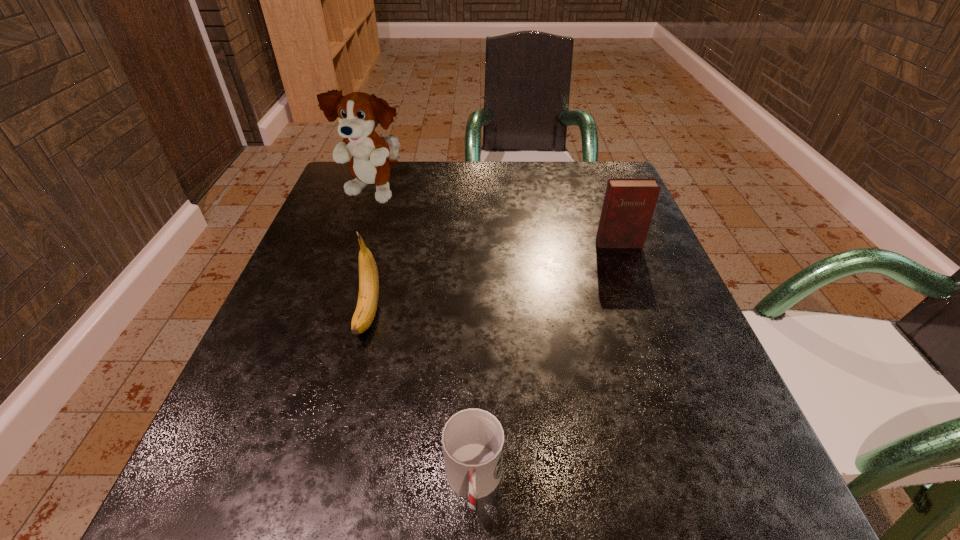
Where is `free point between the farthest object and the rightmost object`? This screenshot has height=540, width=960. free point between the farthest object and the rightmost object is located at coordinates (496, 219).

Locate an element on the screen. object that is the second closest to the farthest object is located at coordinates (629, 203).

Locate an element on the screen. object that ranks as the third closest to the tallest object is located at coordinates (473, 439).